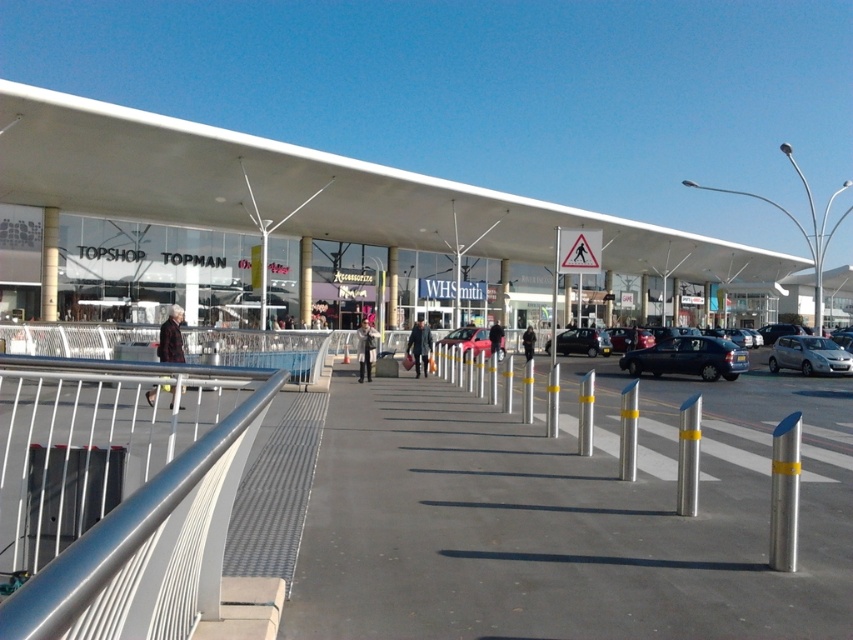
Question: Can you confirm if gray concrete pavement at center is positioned to the right of silver metallic car at right?

Choices:
 (A) yes
 (B) no

Answer: (B)

Question: Is gray concrete pavement at center smaller than matte black car at center?

Choices:
 (A) no
 (B) yes

Answer: (B)

Question: Which point is farther from the camera taking this photo?

Choices:
 (A) (811, 346)
 (B) (277, 188)
 (C) (166, 492)
 (D) (474, 333)

Answer: (B)

Question: Estimate the real-world distances between objects in this image. Which object is farther from the white glass mall at center?

Choices:
 (A) metallic blue sedan at center
 (B) silver metallic rail at lower left
 (C) gray concrete pavement at center
 (D) metallic red car at center

Answer: (B)

Question: Can you confirm if matte black car at center is positioned to the right of metallic red car at center?

Choices:
 (A) yes
 (B) no

Answer: (A)

Question: Which object appears closest to the camera in this image?

Choices:
 (A) metallic blue sedan at center
 (B) white glass mall at center
 (C) metallic red car at center

Answer: (B)